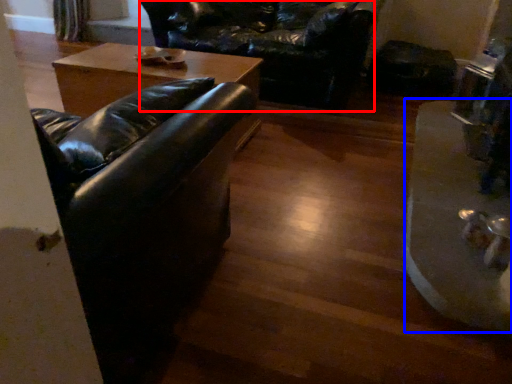
Question: Which point is further to the camera, swivel chair (highlighted by a red box) or wide (highlighted by a blue box)?

Choices:
 (A) swivel chair
 (B) wide

Answer: (A)